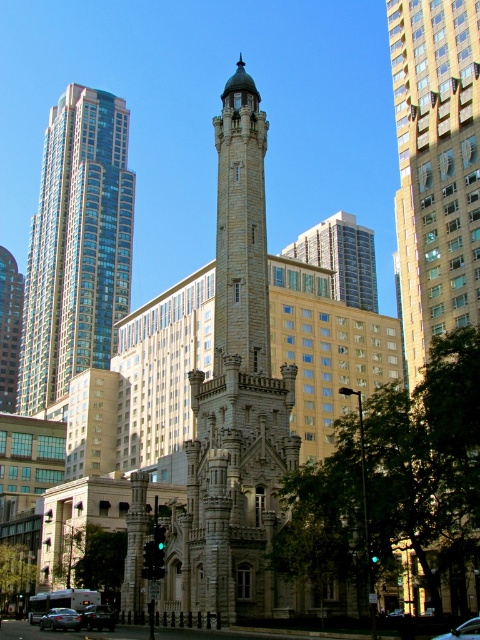
Question: Estimate the real-world distances between objects in this image. Which object is closer to the shiny black sedan at lower right?

Choices:
 (A) shiny glass skyscraper at left
 (B) stone tower at center
 (C) shiny black sedan at lower left
 (D) silver metallic building at center

Answer: (B)

Question: Among these objects, which one is nearest to the camera?

Choices:
 (A) metallic silver car at lower left
 (B) silver metallic building at center
 (C) shiny glass skyscraper at left

Answer: (A)

Question: Can you confirm if silver metallic building at center is positioned above metallic silver car at lower left?

Choices:
 (A) no
 (B) yes

Answer: (B)

Question: Estimate the real-world distances between objects in this image. Which object is farther from the stone tower at center?

Choices:
 (A) shiny black sedan at lower right
 (B) shiny black sedan at lower left
 (C) metallic silver car at lower left

Answer: (A)

Question: Does silver metallic building at center come in front of metallic silver car at lower left?

Choices:
 (A) yes
 (B) no

Answer: (B)

Question: Can you confirm if stone tower at center is positioned to the right of shiny black sedan at lower right?

Choices:
 (A) no
 (B) yes

Answer: (A)